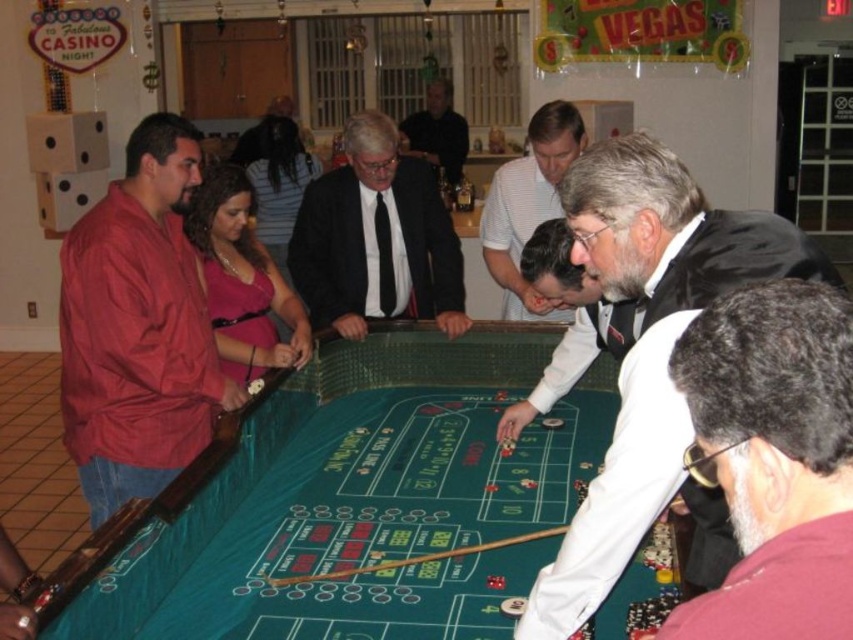
Question: Does white striped shirt at center appear under dark gray suit at center?

Choices:
 (A) no
 (B) yes

Answer: (B)

Question: Estimate the real-world distances between objects in this image. Which object is closer to the matte red jacket at left?

Choices:
 (A) dark gray suit at center
 (B) white satin bow tie at center

Answer: (B)

Question: Which point is closer to the camera?

Choices:
 (A) gray hair at lower right
 (B) white satin bow tie at center

Answer: (A)

Question: From the image, what is the correct spatial relationship of black silk suit at center in relation to white striped shirt at center?

Choices:
 (A) above
 (B) below

Answer: (A)

Question: Which point is farther to the camera?

Choices:
 (A) (74, 284)
 (B) (759, 288)
 (C) (434, 86)

Answer: (C)

Question: Is matte red jacket at left below white striped shirt at center?

Choices:
 (A) yes
 (B) no

Answer: (A)